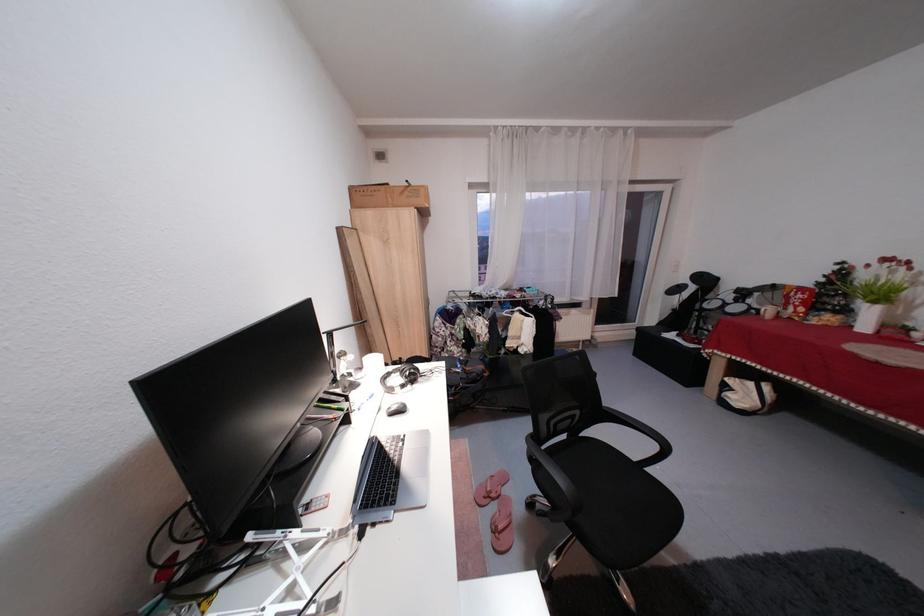
Identify the location of silver laptop computer. Image resolution: width=924 pixels, height=616 pixels. (392, 477).